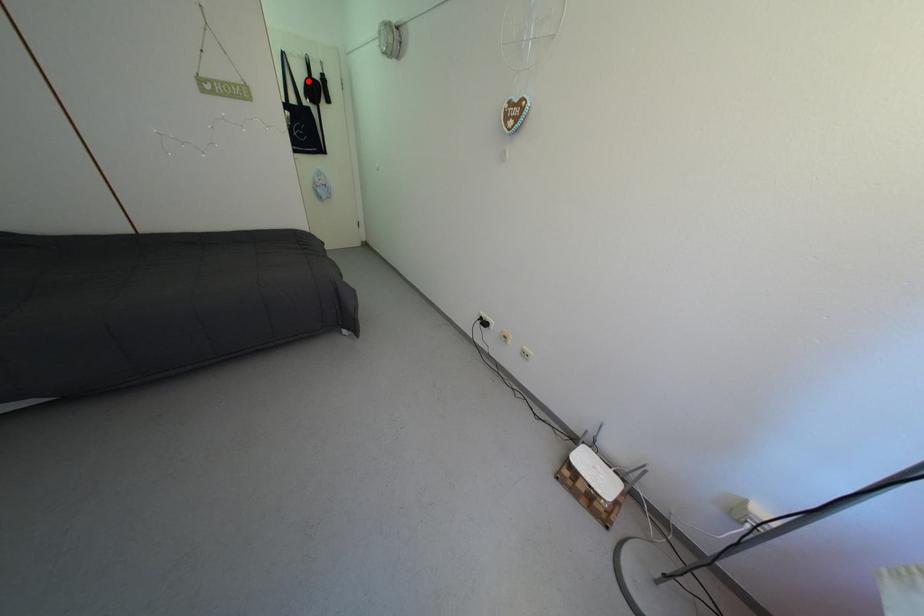
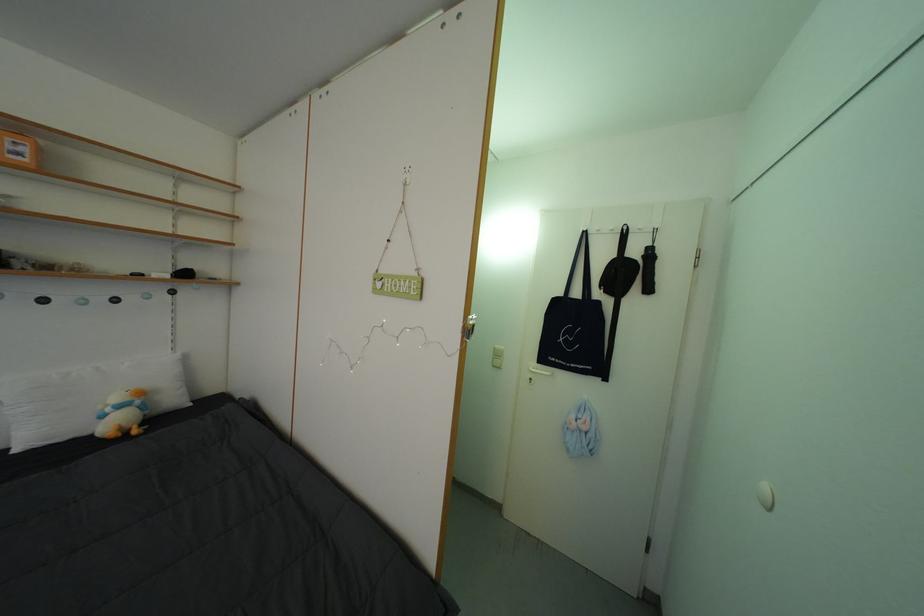
Locate, in the second image, the point that corresponds to the highlighted location in the first image.

(611, 264)